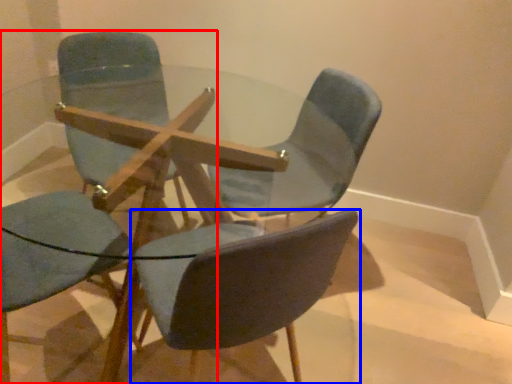
Question: Among these objects, which one is nearest to the camera, chair (highlighted by a red box) or chair (highlighted by a blue box)?

Choices:
 (A) chair
 (B) chair

Answer: (B)